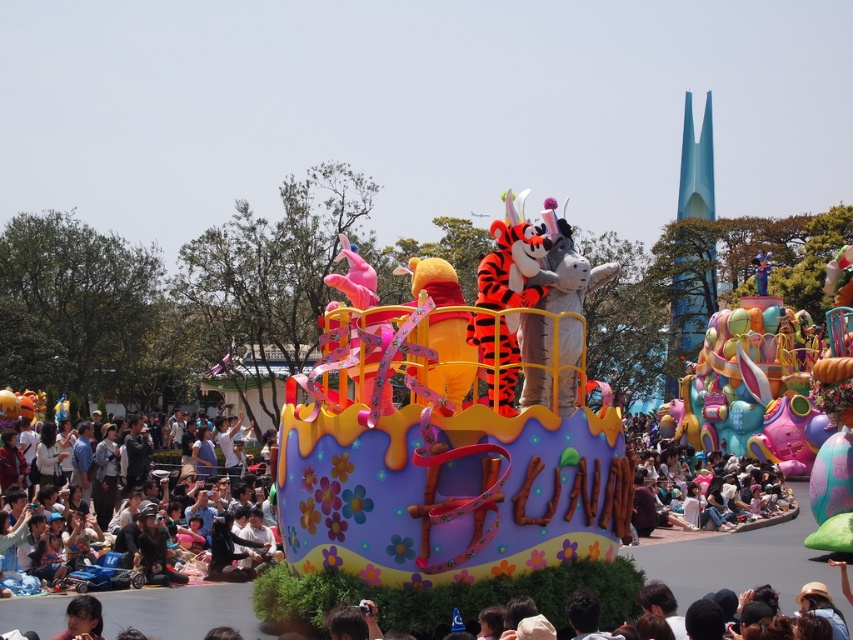
Question: Does matte plastic cake at center appear under matte black jacket at lower left?

Choices:
 (A) yes
 (B) no

Answer: (B)

Question: In this image, where is matte plastic cake at center located relative to matte black jacket at lower left?

Choices:
 (A) above
 (B) below

Answer: (A)

Question: Which point is farther to the camera?

Choices:
 (A) (42, 573)
 (B) (495, 444)

Answer: (A)

Question: In this image, where is matte plastic cake at center located relative to matte black jacket at lower left?

Choices:
 (A) below
 (B) above

Answer: (B)